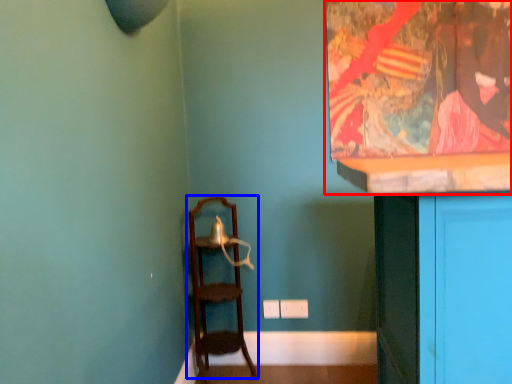
Question: Among these objects, which one is farthest to the camera, picture frame (highlighted by a red box) or furniture (highlighted by a blue box)?

Choices:
 (A) picture frame
 (B) furniture

Answer: (A)